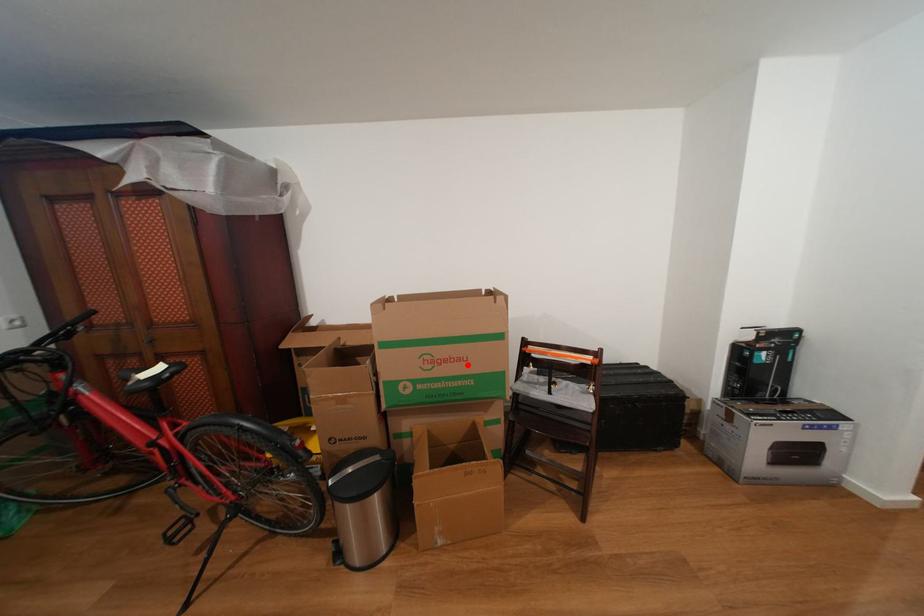
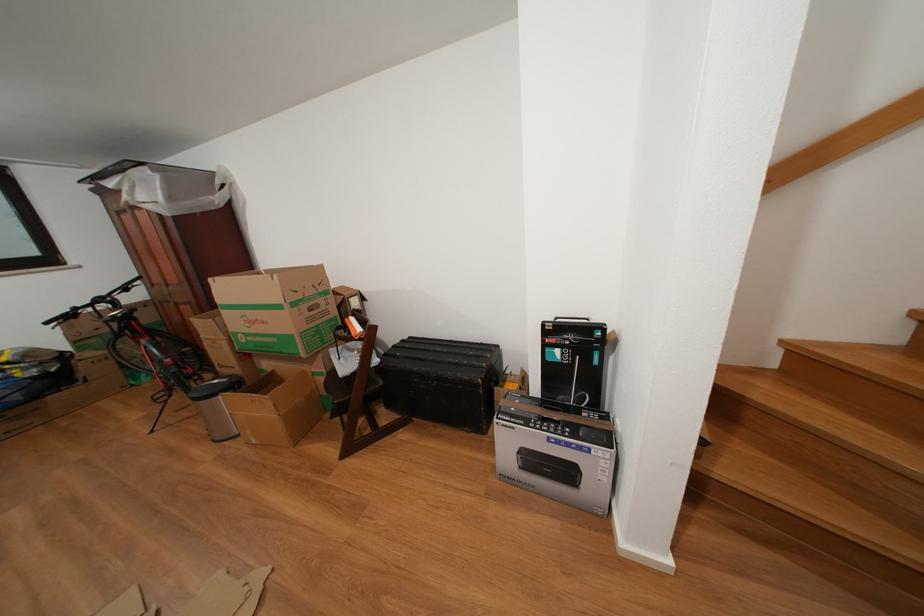
Locate, in the second image, the point that corresponds to the highlighted location in the first image.

(272, 328)